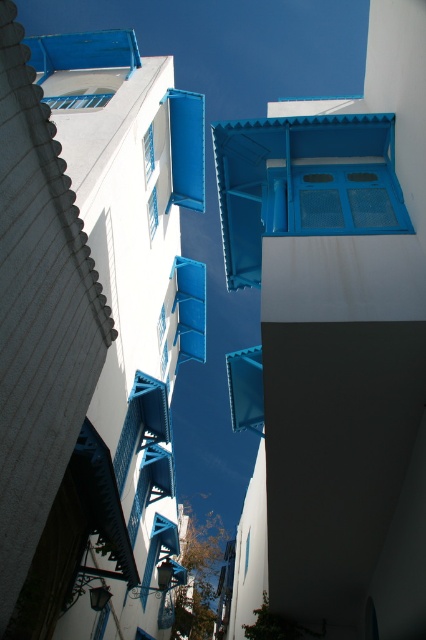
You are an architect analyzing the building design in this image. You notice two blue matte windows. Which one is shorter in height between the blue matte window at upper center and the matte blue window at center?

The blue matte window at upper center is shorter in height than the matte blue window at center.

You are an architect analyzing the placement of windows in this Mediterranean building. Which of the two windows, the blue matte window at upper left or the matte blue window at center, is positioned more to the left side of the building?

The blue matte window at upper left is positioned more to the left side of the building compared to the matte blue window at center.

You are standing at the base of the buildings in this Mediterranean architectural scene. You notice two points marked in the image. The first point is located at coordinates point (91, 96), and the second is at point (149, 212). From your vantage point, which point is closer to you?

Point (91, 96) is in front of point (149, 212), so it is closer to you.